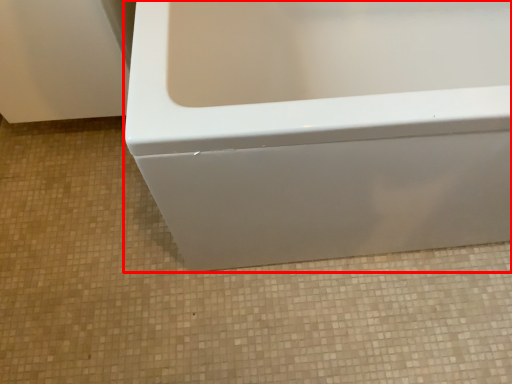
Question: From the image's perspective, what is the correct spatial relationship of bathtub (annotated by the red box) in relation to ceramic tile?

Choices:
 (A) above
 (B) below

Answer: (A)